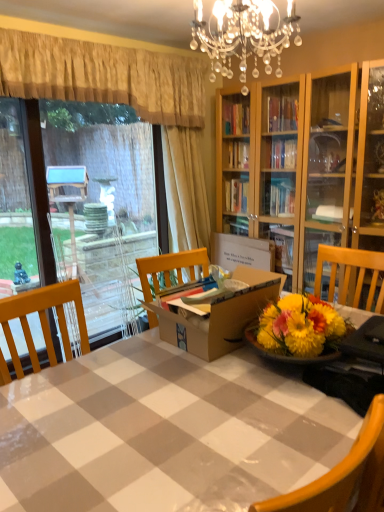
The image size is (384, 512). I want to click on cardboard box at center, so click(x=242, y=252).

You are a GUI agent. You are given a task and a screenshot of the screen. Output one action in this format:
    pyautogui.click(x=<x>, y=<y>)
    Task: Click on the beige fabric curtain at upper left, which ranks as the 1th curtain in right-to-left order
    
    Given the screenshot: What is the action you would take?
    pyautogui.click(x=185, y=189)

This screenshot has width=384, height=512. What do you see at coordinates (104, 76) in the screenshot? I see `yellow textured curtain at upper left, arranged as the 2th curtain when viewed from the right` at bounding box center [104, 76].

Describe the element at coordinates (82, 203) in the screenshot. I see `transparent glass door at left` at that location.

What is the approximate width of transparent glass door at left?

It is 7.85 inches.

You are a GUI agent. You are given a task and a screenshot of the screen. Output one action in this format:
    pyautogui.click(x=<x>, y=<y>)
    Task: Click on the white glossy table at center
    The image size is (384, 512).
    Given the screenshot: What is the action you would take?
    pyautogui.click(x=164, y=432)

Is cardboard box at center taller or shorter than brown cardboard box at center?

cardboard box at center is taller than brown cardboard box at center.

Which is nearer, (224, 268) or (245, 315)?

Point (224, 268).

Visually, is cardboard box at center positioned to the left or to the right of brown cardboard box at center?

Clearly, cardboard box at center is on the right of brown cardboard box at center in the image.

Considering the sizes of cardboard box at center and brown cardboard box at center in the image, is cardboard box at center wider or thinner than brown cardboard box at center?

In the image, cardboard box at center appears to be more narrow than brown cardboard box at center.

Is wooden chair at lower right with yellow textured curtain at upper left, arranged as the 2th curtain when viewed from the right?

They are not placed beside each other.

From a real-world perspective, is wooden chair at lower right beneath yellow textured curtain at upper left, arranged as the 2th curtain when viewed from the right?

Yes.

Is point (336, 476) positioned after point (76, 55)?

No, (336, 476) is in front of (76, 55).

Is wooden chair at lower right oriented away from yellow textured curtain at upper left, arranged as the 2th curtain when viewed from the right?

No, wooden chair at lower right is not facing the opposite direction of yellow textured curtain at upper left, arranged as the 2th curtain when viewed from the right.

Could you tell me if white glossy table at center is facing brown cardboard box at center?

No, white glossy table at center is not aimed at brown cardboard box at center.

Does white glossy table at center have a smaller size compared to brown cardboard box at center?

Actually, white glossy table at center might be larger than brown cardboard box at center.

Between point (137, 428) and point (160, 324), which one is positioned behind?

The point (160, 324) is farther from the camera.

Identify the location of table lying in front of the brown cardboard box at center. This screenshot has height=512, width=384. (164, 432).

How different are the orientations of cardboard box at center and transparent glass door at left in degrees?

The angular difference between cardboard box at center and transparent glass door at left is 88.9 degrees.

Is cardboard box at center in front of transparent glass door at left?

No, cardboard box at center is further to the viewer.

Is cardboard box at center next to transparent glass door at left and touching it?

No, cardboard box at center is not with transparent glass door at left.

Which object is positioned more to the right, cardboard box at center or transparent glass door at left?

Positioned to the right is cardboard box at center.

Considering the sizes of objects wooden chair at lower right and transparent glass door at left in the image provided, who is smaller, wooden chair at lower right or transparent glass door at left?

wooden chair at lower right.

From a real-world perspective, is wooden chair at lower right positioned above or below transparent glass door at left?

Clearly, from a real-world perspective, wooden chair at lower right is below transparent glass door at left.

From the image's perspective, is wooden chair at lower right beneath transparent glass door at left?

Yes, from the image's perspective, wooden chair at lower right is beneath transparent glass door at left.

How different are the orientations of wooden chair at lower right and transparent glass door at left in degrees?

179 degrees separate the facing orientations of wooden chair at lower right and transparent glass door at left.

What's the angular difference between cardboard box at center and white glossy table at center's facing directions?

cardboard box at center and white glossy table at center are facing 89.6 degrees away from each other.

Between point (225, 262) and point (258, 392), which one is positioned in front?

Point (258, 392)

Which object is further away from the camera, cardboard box at center or white glossy table at center?

Positioned behind is cardboard box at center.

Is yellow textured curtain at upper left, arranged as the 2th curtain when viewed from the right, to the left of wooden chair at lower right from the viewer's perspective?

Yes, yellow textured curtain at upper left, arranged as the 2th curtain when viewed from the right, is to the left of wooden chair at lower right.

From their relative heights in the image, would you say yellow textured curtain at upper left, arranged as the 2th curtain when viewed from the right, is taller or shorter than wooden chair at lower right?

In the image, yellow textured curtain at upper left, arranged as the 2th curtain when viewed from the right, appears to be shorter than wooden chair at lower right.

Can you confirm if yellow textured curtain at upper left, the 1th curtain viewed from the left, is thinner than wooden chair at lower right?

Yes, yellow textured curtain at upper left, the 1th curtain viewed from the left, is thinner than wooden chair at lower right.

Is point (4, 47) behind point (357, 501)?

Yes, point (4, 47) is farther from viewer.

Identify the location of cardboard box behind the brown cardboard box at center. (242, 252).

From the image's perspective, starting from the wooden chair at lower right, which curtain is the 2nd one above? Please provide its 2D coordinates.

[(104, 76)]

Which object lies further to the anchor point transparent glass door at left, brown cardboard box at center or yellow textured curtain at upper left, arranged as the 2th curtain when viewed from the right?

brown cardboard box at center.

Which object lies further to the anchor point beige fabric curtain at upper left, which ranks as the 1th curtain in right-to-left order, transparent glass door at left or white glossy table at center?

Based on the image, white glossy table at center appears to be further to beige fabric curtain at upper left, which ranks as the 1th curtain in right-to-left order.

Estimate the real-world distances between objects in this image. Which object is closer to wooden chair at lower right, yellow textured curtain at upper left, arranged as the 2th curtain when viewed from the right, or white glossy table at center?

white glossy table at center.

Consider the image. Considering their positions, is beige fabric curtain at upper left, the 2th curtain when ordered from left to right, positioned closer to wooden chair at lower right than brown cardboard box at center?

Among the two, brown cardboard box at center is located nearer to wooden chair at lower right.

From the image, which object appears to be nearer to yellow textured curtain at upper left, the 1th curtain viewed from the left, beige fabric curtain at upper left, the 2th curtain when ordered from left to right, or white glossy table at center?

beige fabric curtain at upper left, the 2th curtain when ordered from left to right, is positioned closer to the anchor yellow textured curtain at upper left, the 1th curtain viewed from the left.

Consider the image. From the image, which object appears to be farther from wooden chair at lower right, cardboard box at center or beige fabric curtain at upper left, the 2th curtain when ordered from left to right?

beige fabric curtain at upper left, the 2th curtain when ordered from left to right, lies further to wooden chair at lower right than the other object.

Estimate the real-world distances between objects in this image. Which object is closer to beige fabric curtain at upper left, the 2th curtain when ordered from left to right, white glossy table at center or cardboard box at center?

cardboard box at center lies closer to beige fabric curtain at upper left, the 2th curtain when ordered from left to right, than the other object.

When comparing their distances from wooden chair at lower right, does yellow textured curtain at upper left, the 1th curtain viewed from the left, or transparent glass door at left seem further?

transparent glass door at left is further to wooden chair at lower right.

Where is `chair that lies between yellow textured curtain at upper left, arranged as the 2th curtain when viewed from the right, and white glossy table at center from top to bottom`? This screenshot has width=384, height=512. chair that lies between yellow textured curtain at upper left, arranged as the 2th curtain when viewed from the right, and white glossy table at center from top to bottom is located at coordinates (344, 476).

Locate an element on the screen. curtain between white glossy table at center and beige fabric curtain at upper left, the 2th curtain when ordered from left to right, from front to back is located at coordinates (104, 76).

Where is `curtain between yellow textured curtain at upper left, arranged as the 2th curtain when viewed from the right, and cardboard box at center from top to bottom`? This screenshot has width=384, height=512. curtain between yellow textured curtain at upper left, arranged as the 2th curtain when viewed from the right, and cardboard box at center from top to bottom is located at coordinates (185, 189).

Where is `box positioned between white glossy table at center and cardboard box at center from near to far`? Image resolution: width=384 pixels, height=512 pixels. box positioned between white glossy table at center and cardboard box at center from near to far is located at coordinates (219, 316).